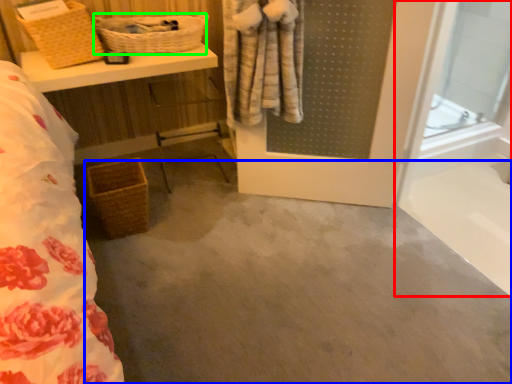
Question: Which object is the closest to the glass door (highlighted by a red box)? Choose among these: concrete (highlighted by a blue box) or basket (highlighted by a green box).

Choices:
 (A) concrete
 (B) basket

Answer: (A)